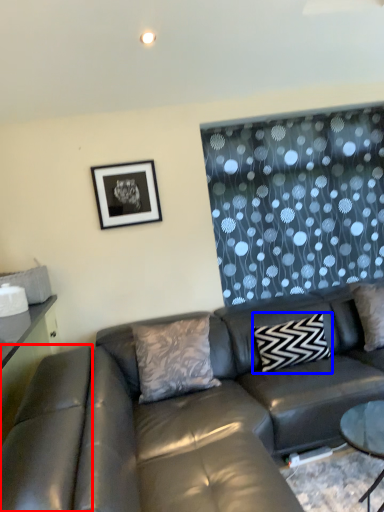
Question: Which point is closer to the camera, swivel chair (highlighted by a red box) or pillow (highlighted by a blue box)?

Choices:
 (A) swivel chair
 (B) pillow

Answer: (A)